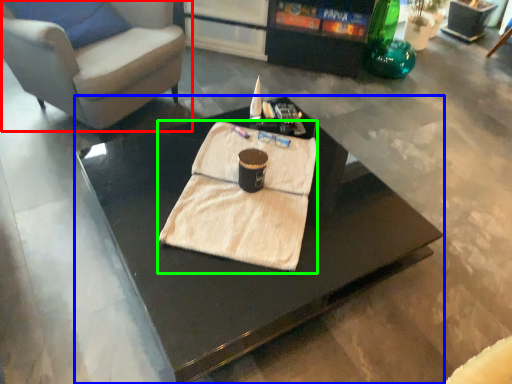
Question: Which object is positioned farthest from chair (highlighted by a red box)? Select from coffee table (highlighted by a blue box) and blanket (highlighted by a green box).

Choices:
 (A) coffee table
 (B) blanket

Answer: (B)